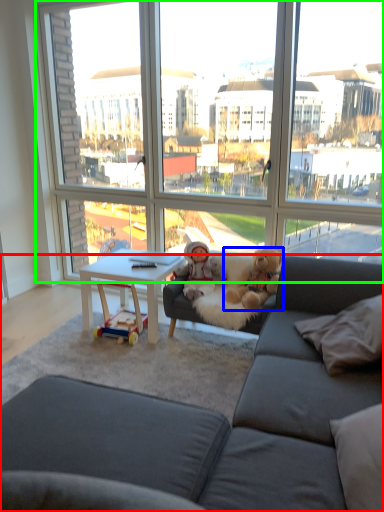
Question: Which object is positioned farthest from studio couch (highlighted by a red box)? Select from teddy bear (highlighted by a blue box) and window (highlighted by a green box).

Choices:
 (A) teddy bear
 (B) window

Answer: (B)